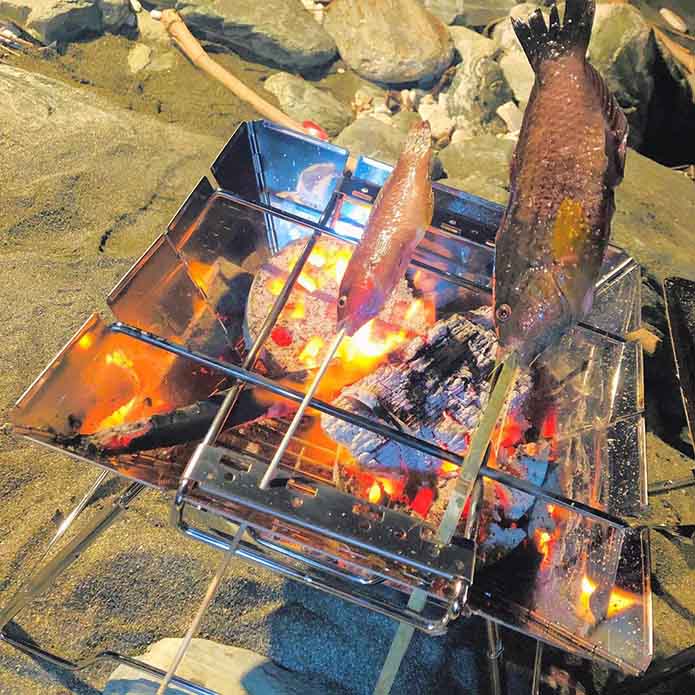
Where is `frame`? frame is located at coordinates (256, 338).